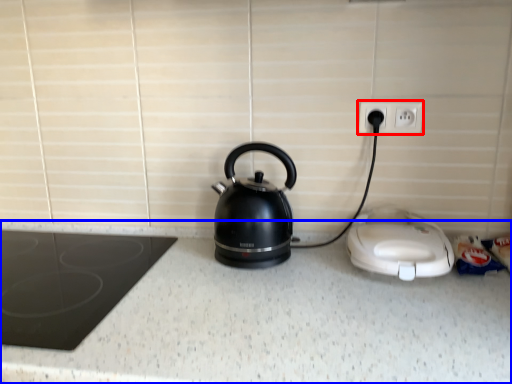
Question: Which of the following is the farthest to the observer, electric outlet (highlighted by a red box) or counter top (highlighted by a blue box)?

Choices:
 (A) electric outlet
 (B) counter top

Answer: (A)